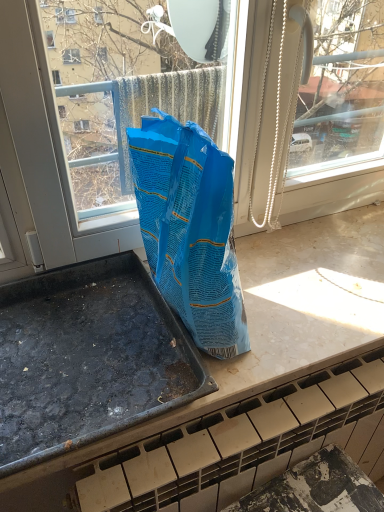
Where is `free space above marble tile window sill at center (from a real-world perspective)`? free space above marble tile window sill at center (from a real-world perspective) is located at coordinates (238, 281).